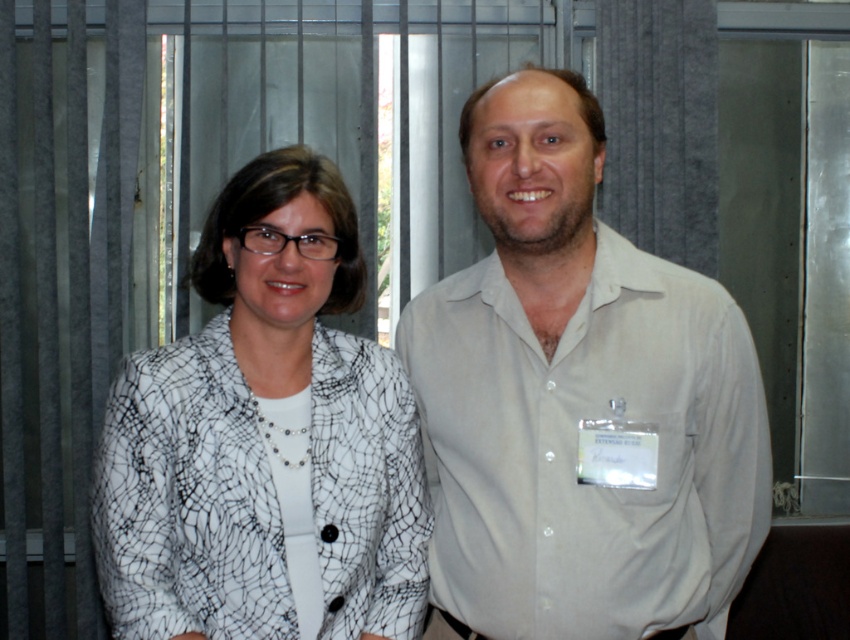
Question: Which point appears farthest from the camera in this image?

Choices:
 (A) (255, 276)
 (B) (480, 442)

Answer: (B)

Question: Can you confirm if light beige shirt at center is positioned below white textured blazer at center?

Choices:
 (A) yes
 (B) no

Answer: (B)

Question: Which point is farther from the camera taking this photo?

Choices:
 (A) (380, 497)
 (B) (620, 524)

Answer: (A)

Question: Can you confirm if light beige shirt at center is bigger than white textured blazer at center?

Choices:
 (A) yes
 (B) no

Answer: (A)

Question: Which point is closer to the camera?

Choices:
 (A) (238, 346)
 (B) (749, 362)

Answer: (A)

Question: Can you confirm if light beige shirt at center is smaller than white textured blazer at center?

Choices:
 (A) yes
 (B) no

Answer: (B)